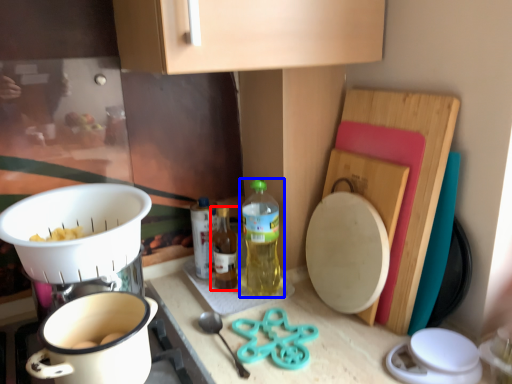
Question: Which of the following is the closest to the observer, bottle (highlighted by a red box) or bottle (highlighted by a blue box)?

Choices:
 (A) bottle
 (B) bottle

Answer: (B)